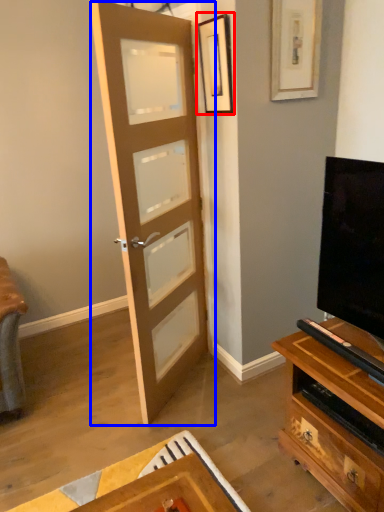
Question: Which point is closer to the camera, picture frame (highlighted by a red box) or door (highlighted by a blue box)?

Choices:
 (A) picture frame
 (B) door

Answer: (B)